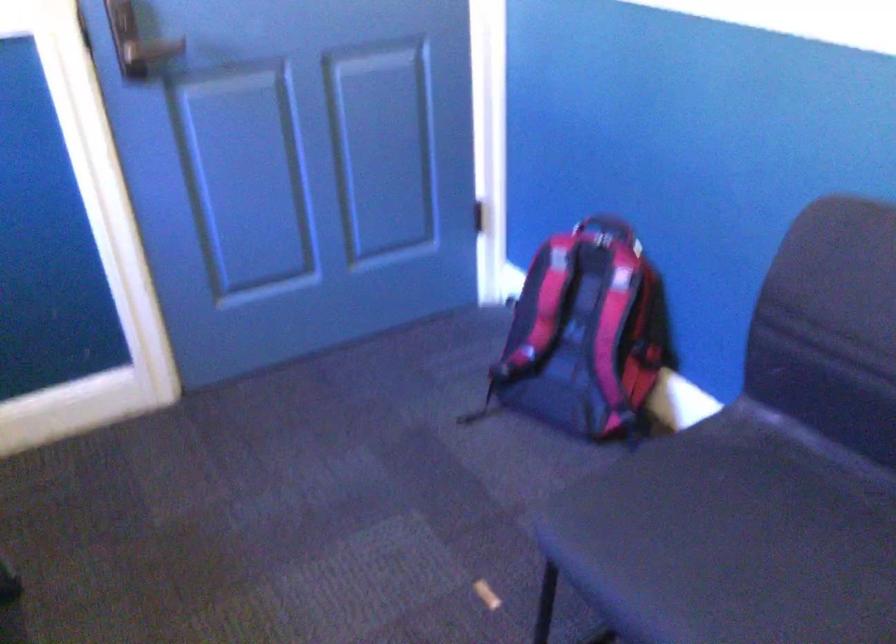
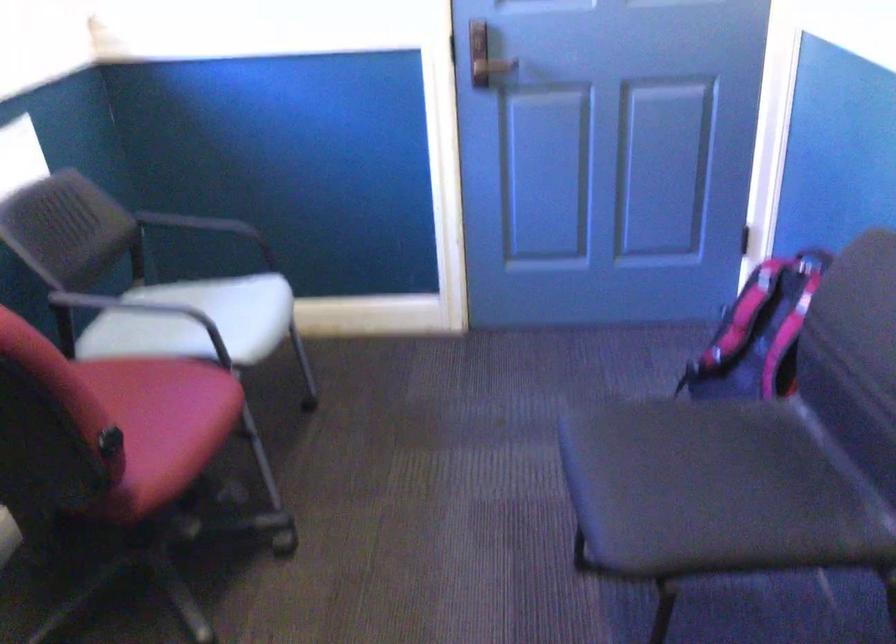
Find the pixel in the second image that matches (x=762, y=556) in the first image.

(698, 485)